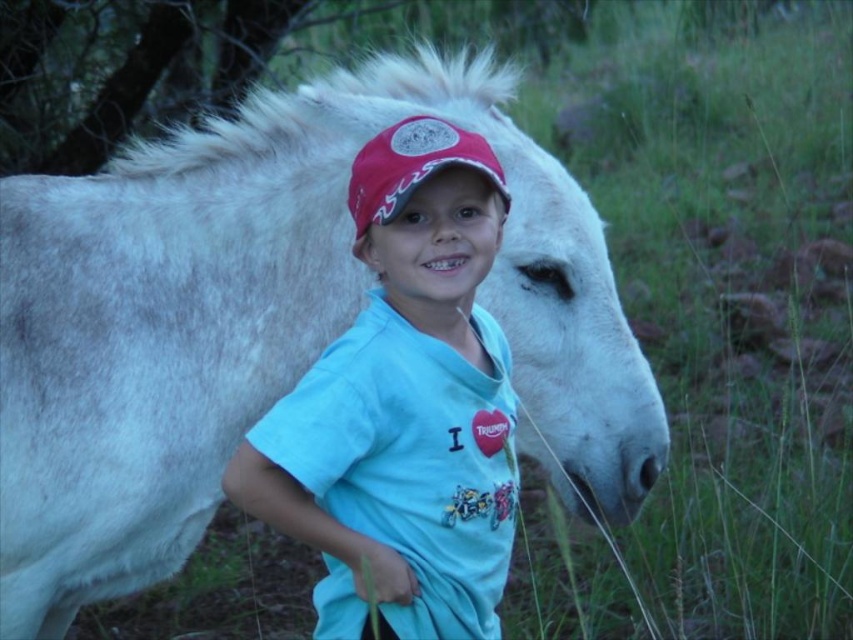
Question: Which point is farther from the camera taking this photo?

Choices:
 (A) (373, 413)
 (B) (328, 156)

Answer: (B)

Question: Can you confirm if white matte horse at center is positioned to the right of matte red cap at center?

Choices:
 (A) yes
 (B) no

Answer: (B)

Question: Is white matte horse at center to the right of matte red cap at center from the viewer's perspective?

Choices:
 (A) no
 (B) yes

Answer: (A)

Question: Is white matte horse at center thinner than matte red cap at center?

Choices:
 (A) no
 (B) yes

Answer: (A)

Question: Among these objects, which one is farthest from the camera?

Choices:
 (A) matte red cap at center
 (B) white matte horse at center

Answer: (B)